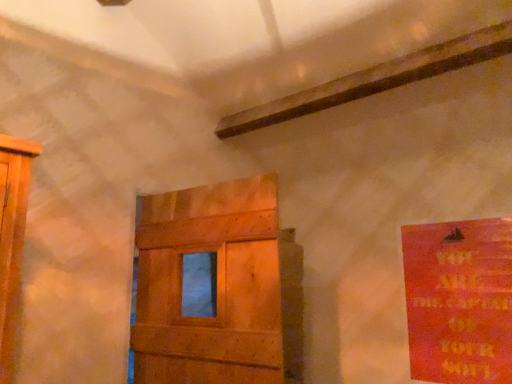
Question: Relative to wooden door at center, is red matte poster at right in front or behind?

Choices:
 (A) front
 (B) behind

Answer: (B)

Question: Looking at the image, does red matte poster at right seem bigger or smaller compared to wooden door at center?

Choices:
 (A) big
 (B) small

Answer: (B)

Question: From the image's perspective, is red matte poster at right positioned above or below wooden door at center?

Choices:
 (A) above
 (B) below

Answer: (B)

Question: Based on their positions, is wooden door at center located to the left or right of red matte poster at right?

Choices:
 (A) right
 (B) left

Answer: (B)

Question: Considering their positions, is wooden door at center located in front of or behind red matte poster at right?

Choices:
 (A) behind
 (B) front

Answer: (B)

Question: Considering the positions of point (161, 284) and point (462, 301), is point (161, 284) closer or farther from the camera than point (462, 301)?

Choices:
 (A) closer
 (B) farther

Answer: (A)

Question: From a real-world perspective, is wooden door at center above or below red matte poster at right?

Choices:
 (A) above
 (B) below

Answer: (A)